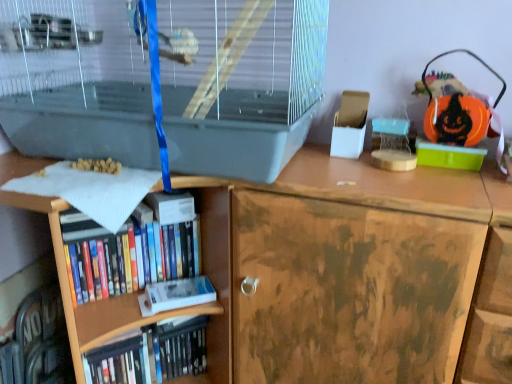
Question: Does clear plastic birdcage at upper left have a lesser width compared to hardcover books at lower left, the 2th book in the bottom-to-top sequence?

Choices:
 (A) no
 (B) yes

Answer: (A)

Question: Is clear plastic birdcage at upper left not near hardcover books at lower left, the 2th book in the bottom-to-top sequence?

Choices:
 (A) no
 (B) yes

Answer: (A)

Question: Is clear plastic birdcage at upper left next to hardcover books at lower left, the 2th book in the bottom-to-top sequence?

Choices:
 (A) no
 (B) yes

Answer: (A)

Question: Can you confirm if clear plastic birdcage at upper left is wider than hardcover books at lower left, which ranks as the 1th book in top-to-bottom order?

Choices:
 (A) no
 (B) yes

Answer: (B)

Question: Is clear plastic birdcage at upper left taller than hardcover books at lower left, the 2th book in the bottom-to-top sequence?

Choices:
 (A) yes
 (B) no

Answer: (A)

Question: From a real-world perspective, relative to clear plastic birdcage at upper left, is white matte paperback book at lower left, acting as the 2th paperback book starting from the top, vertically above or below?

Choices:
 (A) below
 (B) above

Answer: (A)

Question: Is white matte paperback book at lower left, acting as the 2th paperback book starting from the top, inside or outside of clear plastic birdcage at upper left?

Choices:
 (A) inside
 (B) outside

Answer: (B)

Question: Considering the positions of white matte paperback book at lower left, marked as the 1th paperback book in a bottom-to-top arrangement, and clear plastic birdcage at upper left in the image, is white matte paperback book at lower left, marked as the 1th paperback book in a bottom-to-top arrangement, taller or shorter than clear plastic birdcage at upper left?

Choices:
 (A) tall
 (B) short

Answer: (B)

Question: Does point (199, 296) appear closer or farther from the camera than point (190, 130)?

Choices:
 (A) closer
 (B) farther

Answer: (B)

Question: Is clear plastic birdcage at upper left bigger or smaller than white matte paperback book at lower left, acting as the 2th paperback book starting from the top?

Choices:
 (A) big
 (B) small

Answer: (A)

Question: In the image, is clear plastic birdcage at upper left on the left side or the right side of white matte paperback book at lower left, acting as the 2th paperback book starting from the top?

Choices:
 (A) left
 (B) right

Answer: (A)

Question: From a real-world perspective, is clear plastic birdcage at upper left physically located above or below white matte paperback book at lower left, marked as the 1th paperback book in a bottom-to-top arrangement?

Choices:
 (A) below
 (B) above

Answer: (B)

Question: Does point (265, 178) appear closer or farther from the camera than point (144, 292)?

Choices:
 (A) closer
 (B) farther

Answer: (A)

Question: Is white matte paperback book at lower left, marked as the 1th paperback book in a bottom-to-top arrangement, to the left or to the right of hardcover books at lower left, which ranks as the 1th book in top-to-bottom order, in the image?

Choices:
 (A) right
 (B) left

Answer: (A)

Question: Relative to hardcover books at lower left, which ranks as the 1th book in top-to-bottom order, is white matte paperback book at lower left, marked as the 1th paperback book in a bottom-to-top arrangement, in front or behind?

Choices:
 (A) front
 (B) behind

Answer: (B)